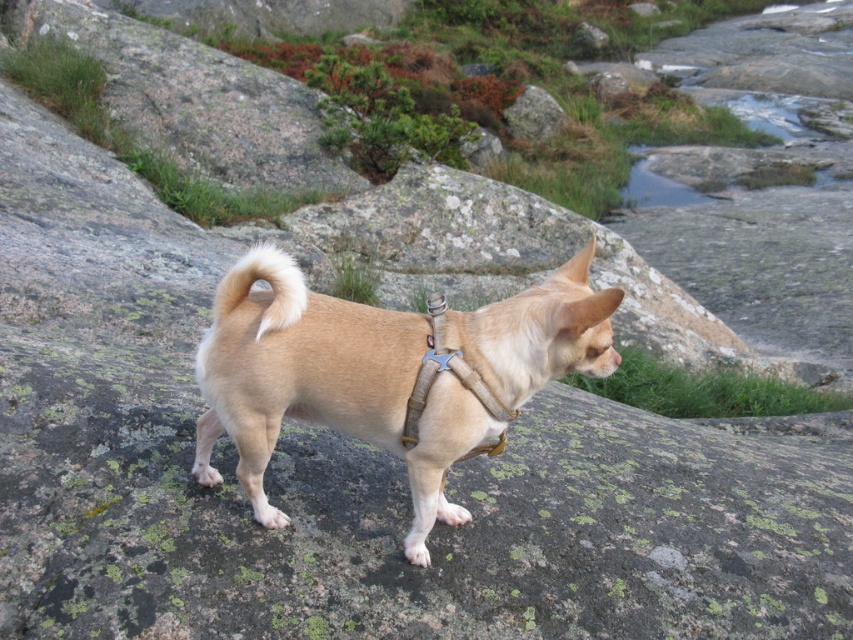
Between tan fabric dog at center and fuzzy beige tail at center, which one has less height?

fuzzy beige tail at center is shorter.

Does point (556, 292) come farther from viewer compared to point (289, 307)?

Yes, point (556, 292) is behind point (289, 307).

Does point (248, 378) lie in front of point (213, 316)?

Yes.

Find the location of a particular element. Image resolution: width=853 pixels, height=640 pixels. tan fabric dog at center is located at coordinates (386, 372).